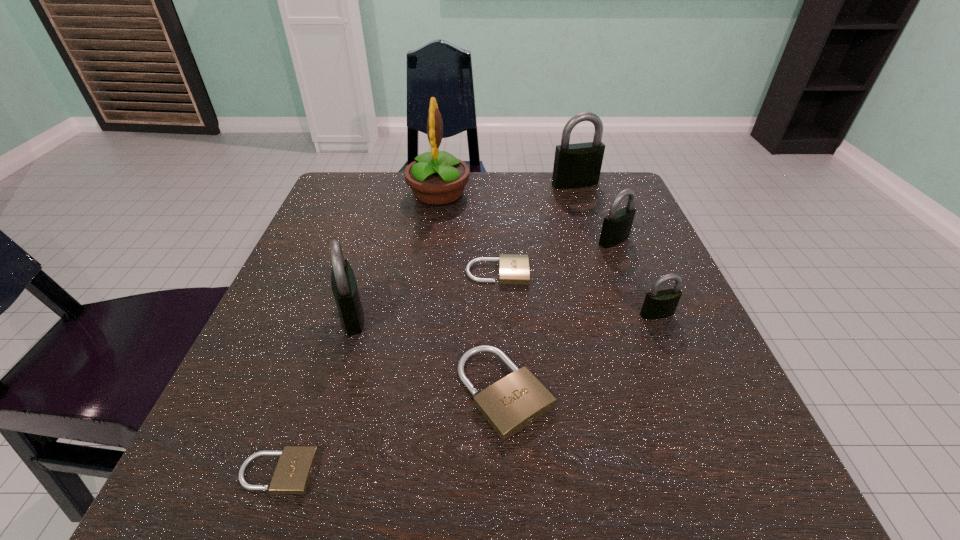
This screenshot has width=960, height=540. Identify the location of free space at the left edge. (303, 326).

Where is `free space at the right edge of the desktop`? free space at the right edge of the desktop is located at coordinates (639, 234).

You are a GUI agent. You are given a task and a screenshot of the screen. Output one action in this format:
    pyautogui.click(x=<x>, y=<y>)
    Task: Click on the vacant space at the far right corner of the desktop
    
    Given the screenshot: What is the action you would take?
    pyautogui.click(x=608, y=188)

The height and width of the screenshot is (540, 960). What are the coordinates of `blank area at the near right corner` in the screenshot? It's located at (715, 458).

Image resolution: width=960 pixels, height=540 pixels. I want to click on empty space between the fifth nearest padlock and the farthest black padlock, so click(x=537, y=228).

This screenshot has height=540, width=960. What are the coordinates of `vacant region between the tallest padlock and the farthest beige padlock` in the screenshot? It's located at (537, 228).

The width and height of the screenshot is (960, 540). I want to click on free spot between the sunflower and the fifth nearest padlock, so click(x=468, y=234).

Find the location of a particular element. The height and width of the screenshot is (540, 960). free spot between the smallest black padlock and the third shortest object is located at coordinates (581, 353).

The width and height of the screenshot is (960, 540). Identify the location of vacant area between the fourth shortest object and the third biggest black padlock. (636, 277).

The height and width of the screenshot is (540, 960). Find the location of `free space between the biggest beige padlock and the biggest black padlock`. free space between the biggest beige padlock and the biggest black padlock is located at coordinates (540, 288).